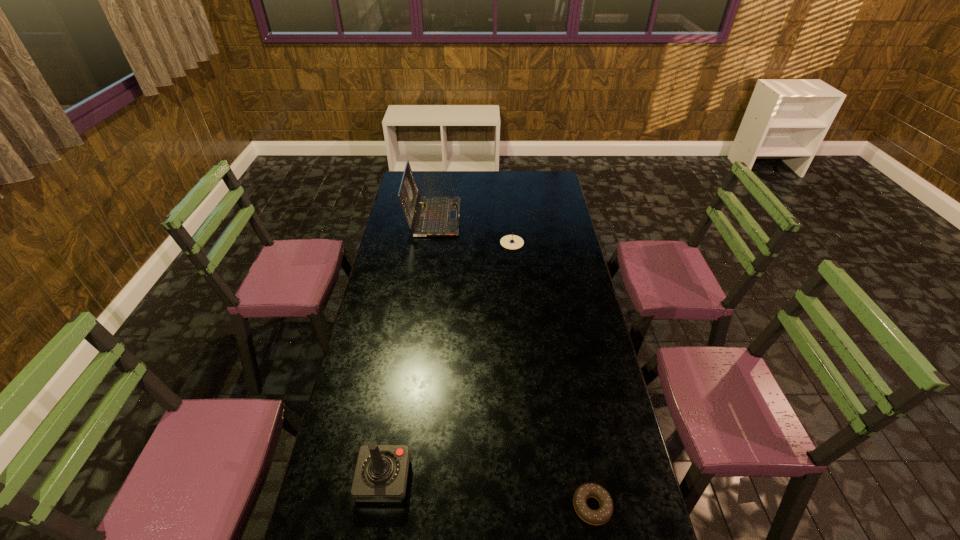
I want to click on laptop computer located at the left edge, so click(437, 216).

You are a GUI agent. You are given a task and a screenshot of the screen. Output one action in this format:
    pyautogui.click(x=<x>, y=<y>)
    Task: Click on the joystick that is at the left edge
    Image resolution: width=960 pixels, height=540 pixels.
    Given the screenshot: What is the action you would take?
    pyautogui.click(x=381, y=473)

Identify the location of object at the right edge. (600, 516).

In the image, there is a desktop. In order to click on vacant space at the far edge in this screenshot , I will do `click(456, 174)`.

In the image, there is a desktop. Where is `vacant space at the left edge`? The width and height of the screenshot is (960, 540). vacant space at the left edge is located at coordinates (391, 259).

Where is `free space at the right edge of the desktop`? Image resolution: width=960 pixels, height=540 pixels. free space at the right edge of the desktop is located at coordinates (550, 194).

Locate an element on the screen. free space that is in between the compass and the joystick is located at coordinates (448, 361).

Find the location of a particular element. free space between the doughnut and the tallest object is located at coordinates (513, 362).

The image size is (960, 540). In order to click on vacant point located between the second tallest object and the tallest object in this screenshot , I will do `click(409, 348)`.

Identify the location of empty location between the laptop computer and the rightmost object. The image size is (960, 540). (513, 362).